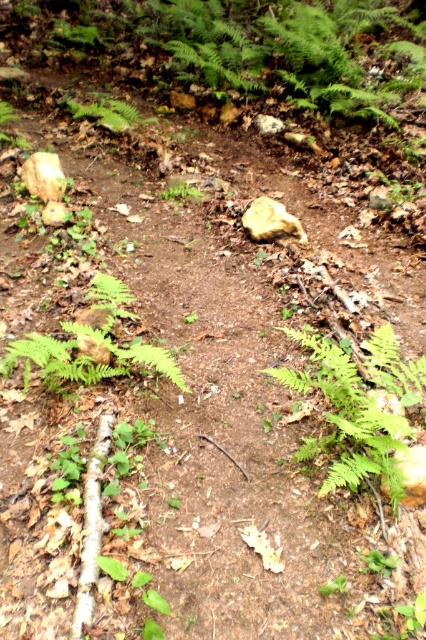
You are a botanist examining two ferns in the forest scene. The first is the green matte fern at center, and the second is the green matte fern at upper center. Which of these ferns has a greater width?

The green matte fern at center has a greater width than the green matte fern at upper center.

You are a hiker who wants to take a photo of both the green leafy fern at center and the green matte fern at center. Since you are standing in the middle of the forest path, can you take a photo that includes both ferns without one blocking the other?

The green leafy fern at center is in front of the green matte fern at center, so the green leafy fern at center will block the view of the green matte fern at center. Therefore, you cannot take a photo that includes both ferns without one blocking the other.

You are standing at the point with coordinates point (124, 109) and want to walk towards the point with coordinates point (299, 372). Which direction should you move relative to your current position?

You should move forward because point (299, 372) is in front of point (124, 109).